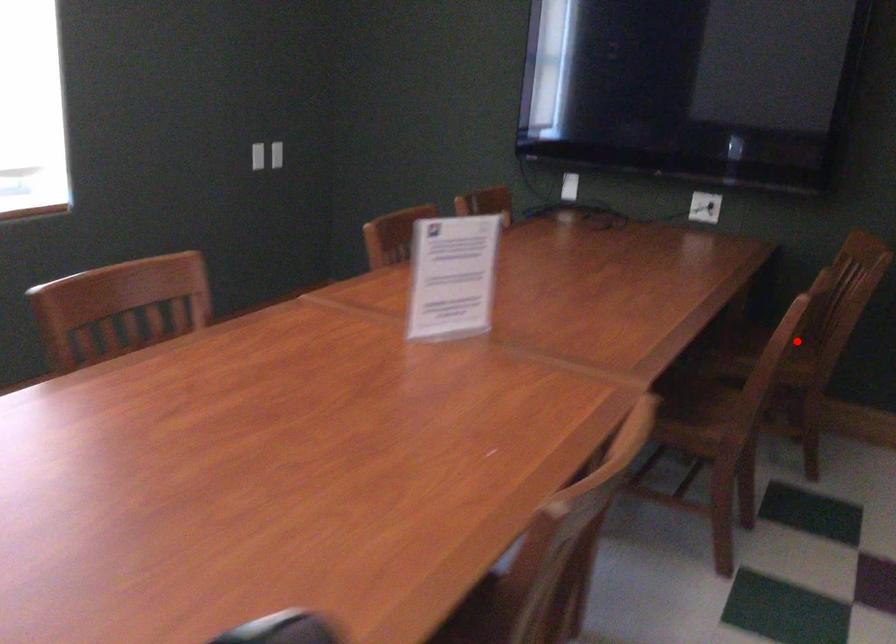
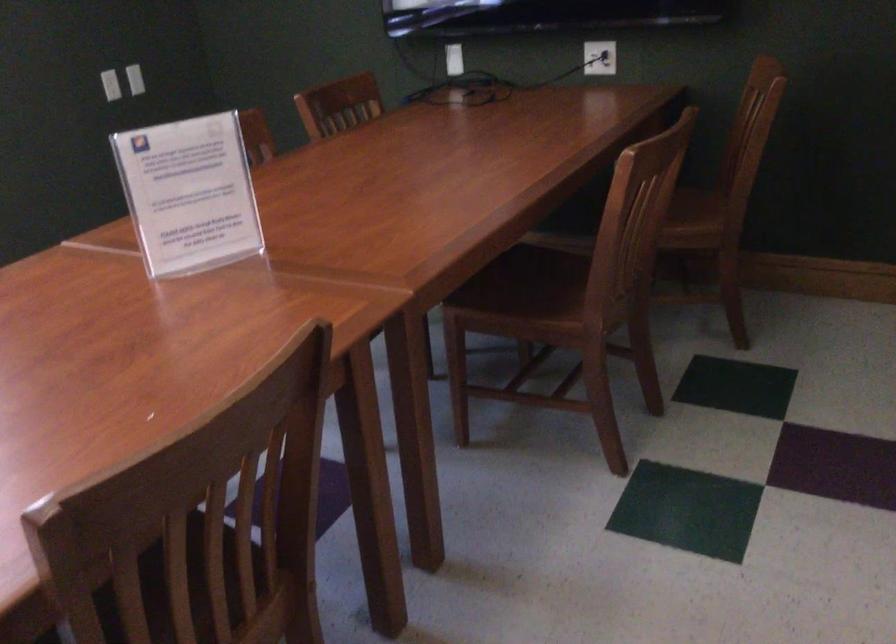
Where in the second image is the point corresponding to the highlighted location from the first image?

(668, 205)